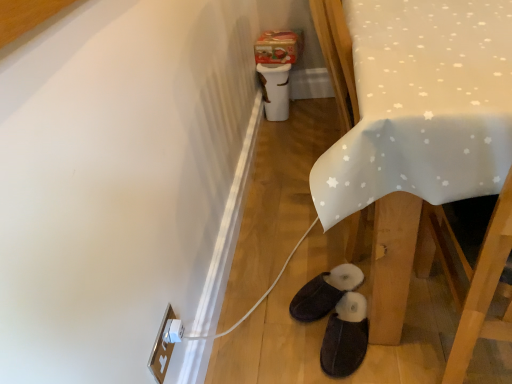
The width and height of the screenshot is (512, 384). Identify the location of free spot behind dark brown suede slippers at lower center, which ranks as the second footwear in back-to-front order. (309, 274).